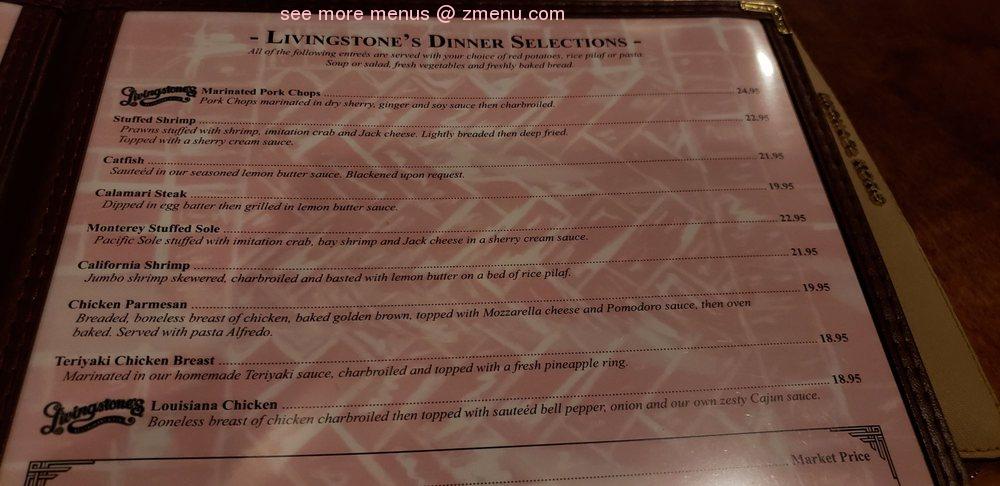
You are a GUI agent. You are given a task and a screenshot of the screen. Output one action in this format:
    pyautogui.click(x=<x>, y=<y>)
    Task: Click on the restaurant menu
    This screenshot has width=1000, height=486.
    Given the screenshot: What is the action you would take?
    pyautogui.click(x=660, y=47)